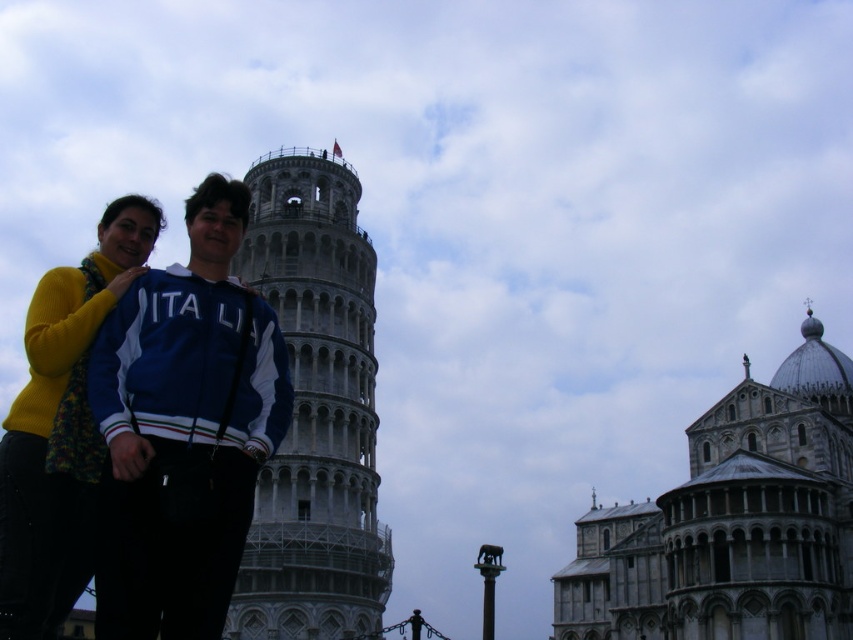
You are standing in front of the white stone tower at center and want to take a photo that includes both the tower and the two people in the foreground. Given that the tower is 209.92 feet away from you, do you think you can fit both the tower and the people in the same frame without moving closer or farther away?

The white stone tower at center is 209.92 feet away from the camera. Since the two people are in the foreground, they are closer to the camera than the tower. Depending on the camera lens and field of view, it might be possible to capture both in the same frame without moving, but the exact feasibility depends on the camera settings. However, the question specifies not to assume additional details beyond the provided information, so based solely on the distance given, the tower is far enough that the people

You are standing in front of the gray stone tower at center and want to take a selfie. The selfie stick you have can extend up to 2 meters. Can you reach the tower in your photo with the selfie stick?

The gray stone tower at center is 73.74 meters away from the viewer. Since the selfie stick can only extend up to 2 meters, it is impossible to capture the tower in the selfie as the distance is far beyond the reach of the selfie stick.

Looking at this image, you are a tourist visiting the Leaning Tower of Pisa. You see two towers in the image, the gray stone tower at center and the white stone tower at center. Which one is bigger?

The gray stone tower at center is larger in size than the white stone tower at center.